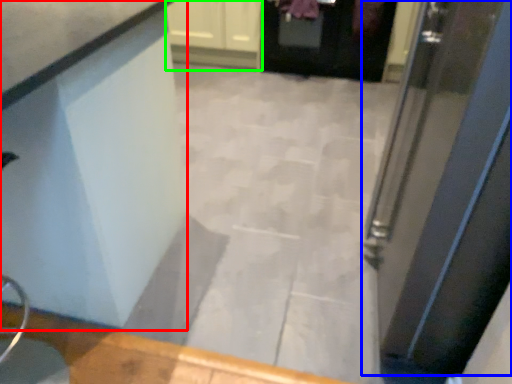
Question: Which object is the closest to the counter (highlighted by a red box)? Choose among these: door (highlighted by a blue box) or cabinetry (highlighted by a green box).

Choices:
 (A) door
 (B) cabinetry

Answer: (A)